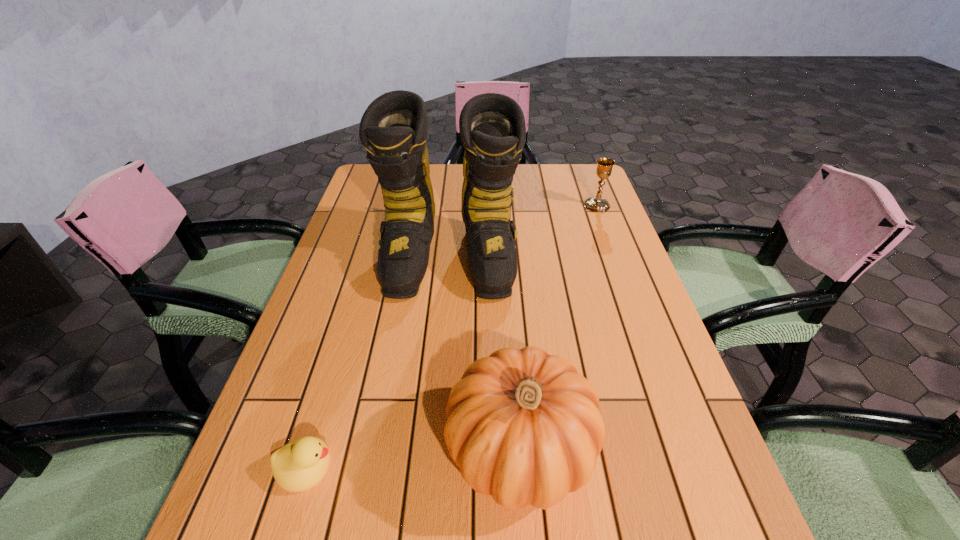
Where is `vacant area that lies between the second tallest object and the duckling`? The height and width of the screenshot is (540, 960). vacant area that lies between the second tallest object and the duckling is located at coordinates coord(413,458).

The image size is (960, 540). Find the location of `vacant point located between the tallest object and the rightmost object`. vacant point located between the tallest object and the rightmost object is located at coordinates (x=523, y=233).

Locate an element on the screen. vacant space that's between the second tallest object and the shortest object is located at coordinates (x=413, y=458).

Where is `free space between the tallest object and the chalice`? This screenshot has width=960, height=540. free space between the tallest object and the chalice is located at coordinates (523, 233).

Locate an element on the screen. The width and height of the screenshot is (960, 540). free space between the duckling and the third shortest object is located at coordinates (413, 458).

Identify the location of vacant area that lies between the third shortest object and the duckling. This screenshot has height=540, width=960. (413, 458).

This screenshot has width=960, height=540. I want to click on empty space between the duckling and the third shortest object, so click(x=413, y=458).

This screenshot has width=960, height=540. I want to click on vacant space that's between the second shortest object and the pumpkin, so click(x=559, y=328).

This screenshot has width=960, height=540. I want to click on blank region between the pumpkin and the second farthest object, so click(485, 355).

In order to click on the closest object to the pumpkin in this screenshot , I will do `click(298, 466)`.